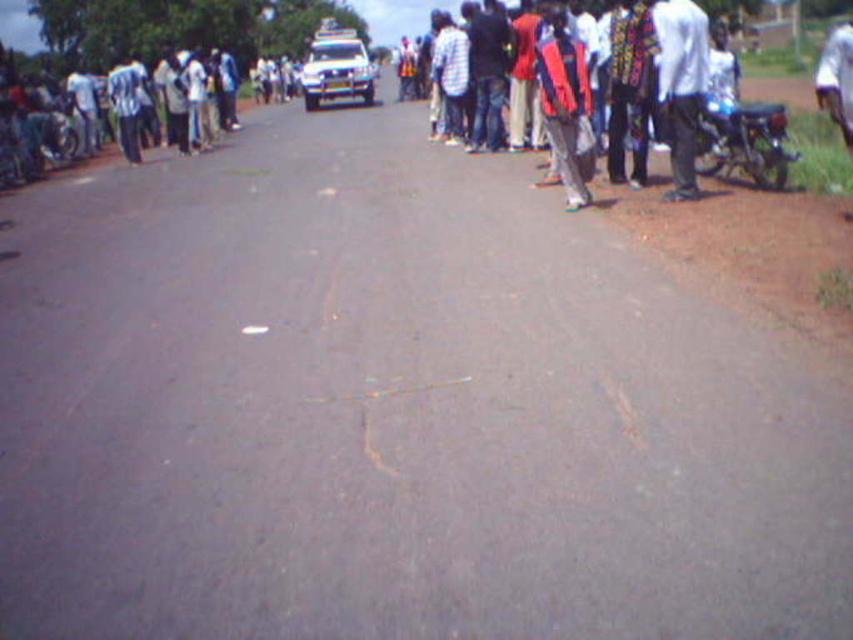
Question: Is red fabric crowd at center thinner than jeans at center?

Choices:
 (A) yes
 (B) no

Answer: (A)

Question: Does red fabric crowd at center have a larger size compared to gold metallic line at center?

Choices:
 (A) yes
 (B) no

Answer: (A)

Question: Is red fabric crowd at center closer to camera compared to white matte shirt at right?

Choices:
 (A) yes
 (B) no

Answer: (B)

Question: Based on their relative distances, which object is nearer to the gold metallic line at center?

Choices:
 (A) white matte shirt at right
 (B) jeans at center
 (C) red fabric crowd at center

Answer: (A)

Question: Which point is closer to the camera taking this photo?

Choices:
 (A) (445, 380)
 (B) (682, 125)
 (C) (711, 166)

Answer: (A)

Question: Which object is the farthest from the white glossy car at center?

Choices:
 (A) white matte shirt at right
 (B) red fabric crowd at center

Answer: (B)